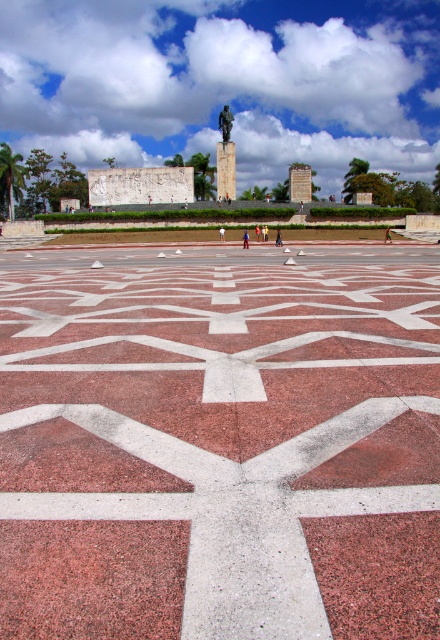
Does red granite square at center have a greater height compared to green fabric person at center?

In fact, red granite square at center may be shorter than green fabric person at center.

Does red granite square at center have a greater width compared to green fabric person at center?

No, red granite square at center is not wider than green fabric person at center.

Who is more distant from viewer, (334, 627) or (385, 237)?

Point (385, 237)

Where is `red granite square at center`? red granite square at center is located at coordinates (377, 573).

Consider the image. Is light brown wooden statue at center above yellow fabric shirt at center?

No, light brown wooden statue at center is not above yellow fabric shirt at center.

Does light brown wooden statue at center have a greater width compared to yellow fabric shirt at center?

No.

Does point (245, 237) come farther from viewer compared to point (264, 234)?

No, it is in front of (264, 234).

Identify the location of light brown wooden statue at center. pyautogui.click(x=245, y=240).

Between point (245, 230) and point (279, 236), which one is positioned in front?

Positioned in front is point (279, 236).

Does light brown wooden statue at center have a greater height compared to matte black statue at center?

Incorrect, light brown wooden statue at center's height is not larger of matte black statue at center's.

Find the location of a particular element. This screenshot has height=640, width=440. light brown wooden statue at center is located at coordinates [245, 240].

Locate an element on the screen. This screenshot has width=440, height=640. light brown wooden statue at center is located at coordinates (x=245, y=240).